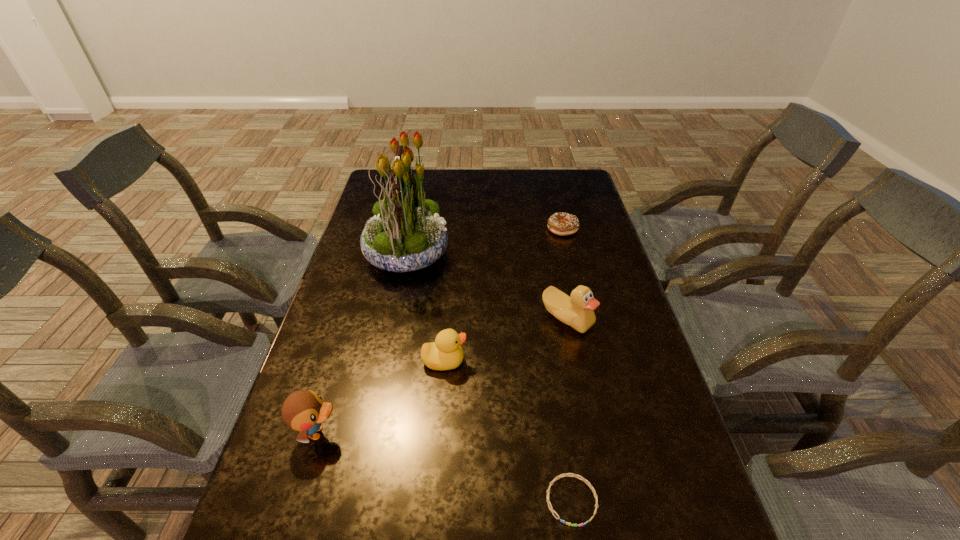
Locate an element on the screen. The image size is (960, 540). vacant space at the left edge is located at coordinates (315, 452).

The width and height of the screenshot is (960, 540). Identify the location of vacant region at the right edge of the desktop. (628, 388).

Where is `vacant space at the far right corner of the desktop`? vacant space at the far right corner of the desktop is located at coordinates (574, 198).

In order to click on free space between the fourth farthest object and the rightmost duck in this screenshot , I will do `click(506, 340)`.

Locate an element on the screen. This screenshot has width=960, height=540. blank region between the bracelet and the third farthest object is located at coordinates (569, 410).

Where is `free spot between the leftmost duck and the fifth tallest object`? The width and height of the screenshot is (960, 540). free spot between the leftmost duck and the fifth tallest object is located at coordinates (440, 331).

This screenshot has height=540, width=960. I want to click on vacant area that lies between the doughnut and the rightmost duck, so click(x=564, y=274).

Locate an element on the screen. The width and height of the screenshot is (960, 540). empty location between the rightmost duck and the second nearest duck is located at coordinates (x=506, y=340).

Locate an element on the screen. The height and width of the screenshot is (540, 960). free space between the doughnut and the second nearest object is located at coordinates (440, 331).

Find the location of `blank region between the doughnut and the farthest duck`. blank region between the doughnut and the farthest duck is located at coordinates (564, 274).